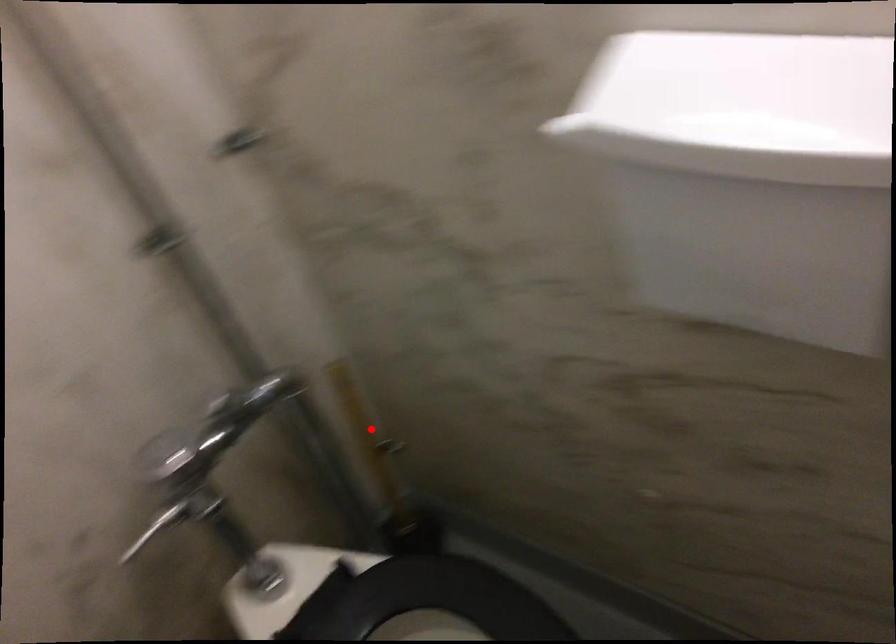
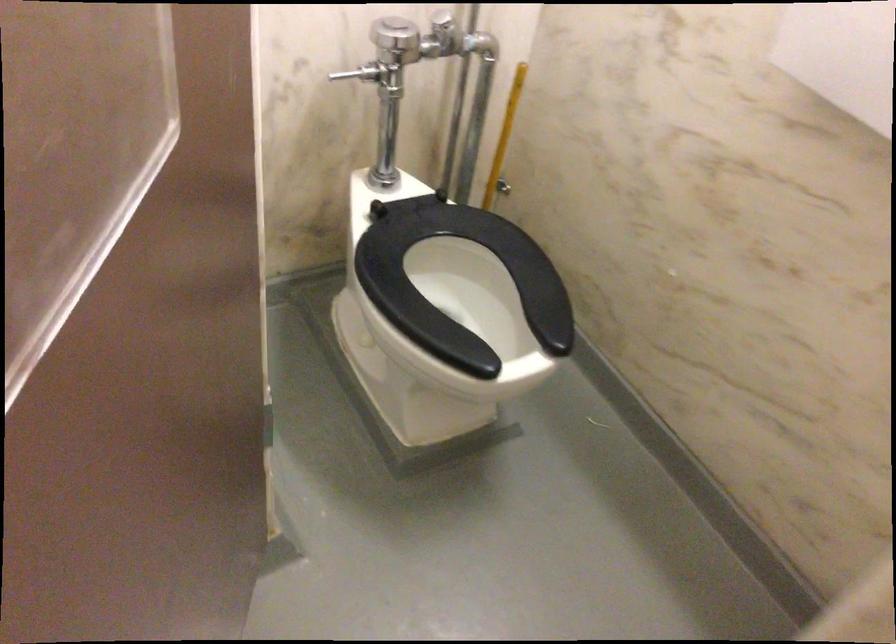
Find the pixel in the second image that matches the highlighted location in the first image.

(504, 137)